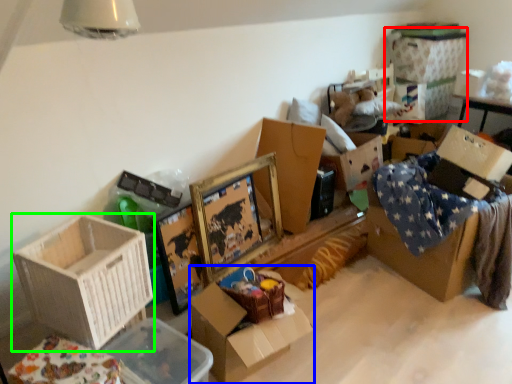
Question: Which object is the farthest from storage box (highlighted by a red box)? Choose among these: box (highlighted by a blue box) or box (highlighted by a green box).

Choices:
 (A) box
 (B) box

Answer: (B)